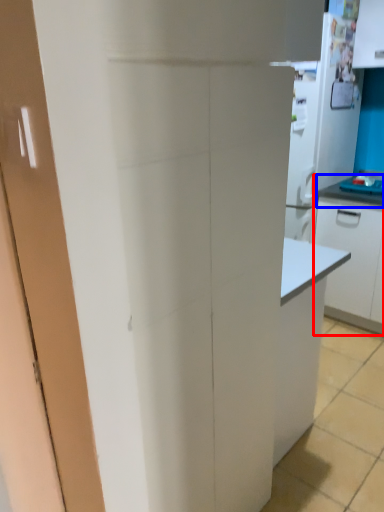
Question: Which point is closer to the camera, cabinetry (highlighted by a red box) or countertop (highlighted by a blue box)?

Choices:
 (A) cabinetry
 (B) countertop

Answer: (A)